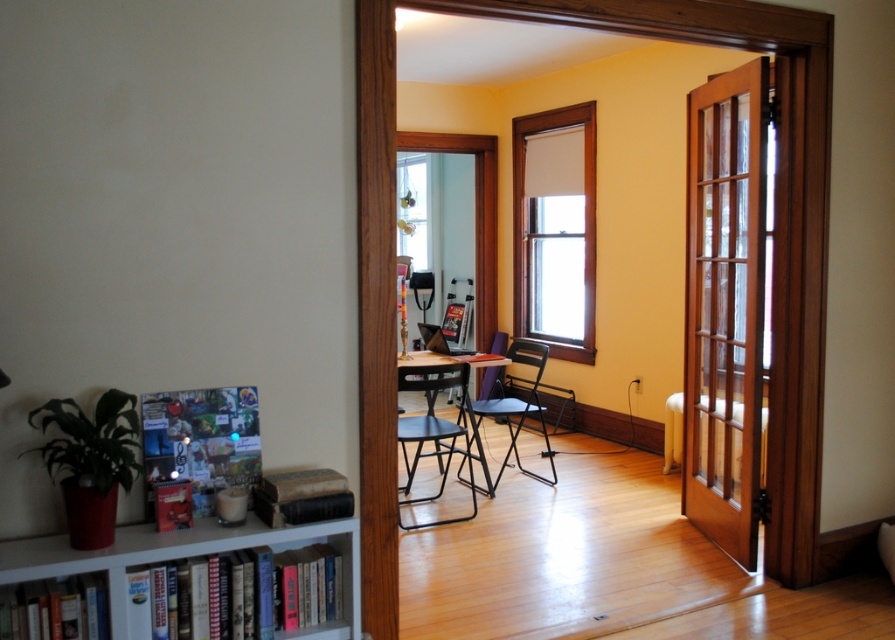
You are standing in front of the open wooden door frame looking into the study. There are two points marked in the room. The first point is at coordinates point (x=209, y=528) and the second is at point (x=587, y=321). Which of these two points is closer to you as you stand at the door?

Point (x=209, y=528) is closer to the viewer than point (x=587, y=321).

You are standing in the hallway outside the room. You see a point at coordinates [723,307]. Is this point located on the mahogany wood door at right or on the wooden table with laptop and papers?

The point at coordinates [723,307] is located on the mahogany wood door at right according to the description.